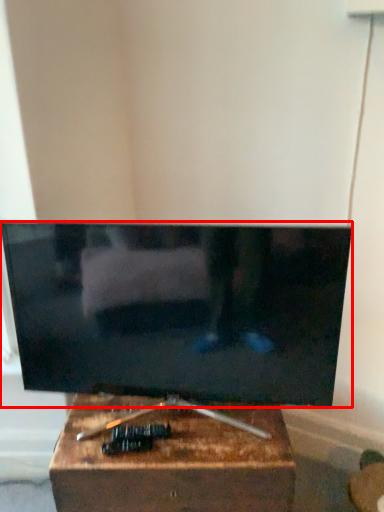
Question: From the image, what is the correct spatial relationship of television (annotated by the red box) in relation to furniture?

Choices:
 (A) left
 (B) right

Answer: (A)